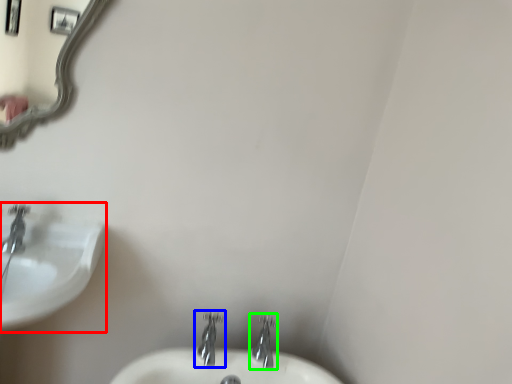
Question: Which object is the closest to the sink (highlighted by a red box)? Choose among these: tap (highlighted by a blue box) or tap (highlighted by a green box).

Choices:
 (A) tap
 (B) tap

Answer: (A)